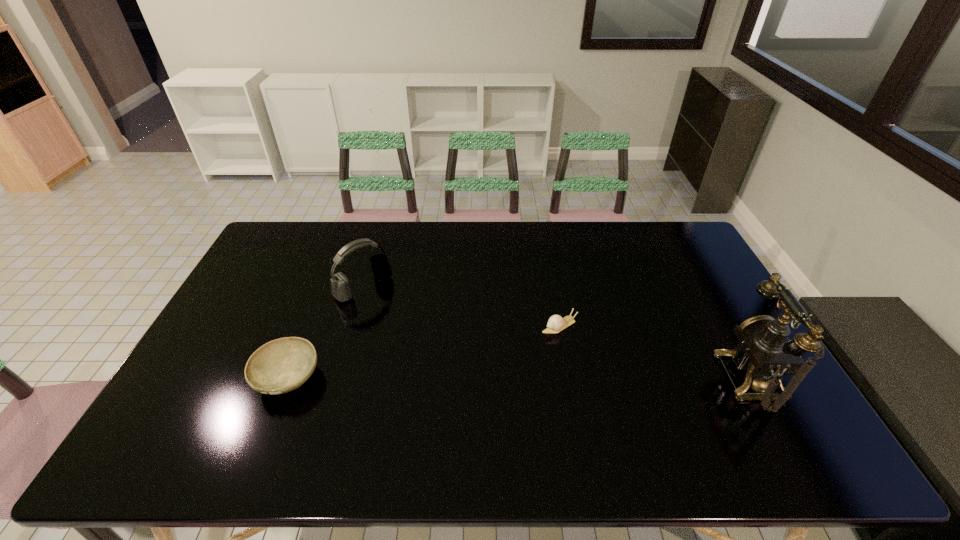
Locate an element on the screen. This screenshot has height=540, width=960. free space on the desktop that is between the third tallest object and the tallest object and is positioned on the headband of the headset is located at coordinates (458, 378).

The width and height of the screenshot is (960, 540). Identify the location of free space on the desktop that is between the bowl and the telephone and is positioned on the shell of the shortest object. 475,378.